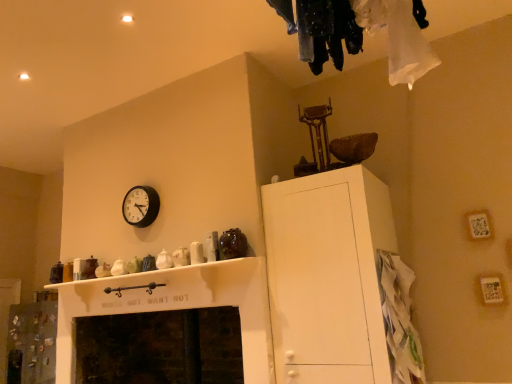
Image resolution: width=512 pixels, height=384 pixels. I want to click on white matte cabinet at upper right, so click(x=327, y=276).

Measure the distance between point (312, 371) and camera.

Point (312, 371) and camera are 2.67 meters apart from each other.

The height and width of the screenshot is (384, 512). What do you see at coordinates (160, 348) in the screenshot? I see `dark stone fireplace at lower center` at bounding box center [160, 348].

Measure the distance between point (234, 346) and camera.

Point (234, 346) and camera are 3.97 meters apart.

Image resolution: width=512 pixels, height=384 pixels. Find the location of `white paper bag at lower right`. white paper bag at lower right is located at coordinates (399, 319).

From the image's perspective, which one is positioned lower, dark stone fireplace at lower center or white paper bag at lower right?

dark stone fireplace at lower center is shown below in the image.

Image resolution: width=512 pixels, height=384 pixels. In order to click on fireplace behind the white paper bag at lower right in this screenshot , I will do `click(160, 348)`.

Relative to white paper bag at lower right, is dark stone fireplace at lower center in front or behind?

dark stone fireplace at lower center is behind white paper bag at lower right.

Considering the relative sizes of dark stone fireplace at lower center and white paper bag at lower right in the image provided, is dark stone fireplace at lower center taller than white paper bag at lower right?

Incorrect, the height of dark stone fireplace at lower center is not larger of that of white paper bag at lower right.

Is black plastic clock at upper left looking in the opposite direction of white matte cabinet at upper right?

No, black plastic clock at upper left is not facing away from white matte cabinet at upper right.

Considering the relative sizes of black plastic clock at upper left and white matte cabinet at upper right in the image provided, is black plastic clock at upper left wider than white matte cabinet at upper right?

No, black plastic clock at upper left is not wider than white matte cabinet at upper right.

Considering the sizes of objects black plastic clock at upper left and white matte cabinet at upper right in the image provided, who is taller, black plastic clock at upper left or white matte cabinet at upper right?

With more height is white matte cabinet at upper right.

From a real-world perspective, which is physically below, black plastic clock at upper left or white matte cabinet at upper right?

white matte cabinet at upper right is physically lower.

Are white paper bag at lower right and dark stone fireplace at lower center beside each other?

white paper bag at lower right and dark stone fireplace at lower center are clearly separated.

From the image's perspective, is white paper bag at lower right beneath dark stone fireplace at lower center?

No, from the image's perspective, white paper bag at lower right is not beneath dark stone fireplace at lower center.

In the scene shown: Considering the relative sizes of white paper bag at lower right and dark stone fireplace at lower center in the image provided, is white paper bag at lower right thinner than dark stone fireplace at lower center?

Yes.

What's the angular difference between white paper bag at lower right and dark stone fireplace at lower center's facing directions?

The angular difference between white paper bag at lower right and dark stone fireplace at lower center is 90.6 degrees.

Does white paper bag at lower right appear on the left side of black plastic clock at upper left?

No.

Is white paper bag at lower right positioned with its back to black plastic clock at upper left?

Yes, white paper bag at lower right's orientation is away from black plastic clock at upper left.

Is white paper bag at lower right wider or thinner than black plastic clock at upper left?

In the image, white paper bag at lower right appears to be wider than black plastic clock at upper left.

How different are the orientations of white paper bag at lower right and black plastic clock at upper left in degrees?

The facing directions of white paper bag at lower right and black plastic clock at upper left are 91.7 degrees apart.

Consider the image. How many degrees apart are the facing directions of white matte cabinet at upper right and white paper bag at lower right?

white matte cabinet at upper right and white paper bag at lower right are facing 90 degrees away from each other.

Considering the positions of objects white matte cabinet at upper right and white paper bag at lower right in the image provided, who is more to the right, white matte cabinet at upper right or white paper bag at lower right?

From the viewer's perspective, white paper bag at lower right appears more on the right side.

Which of these two, white matte cabinet at upper right or white paper bag at lower right, is bigger?

white matte cabinet at upper right.

Find the location of a particular element. Image resolution: width=512 pixels, height=384 pixels. cabinetry on the left of white paper bag at lower right is located at coordinates (327, 276).

Considering the relative positions of white matte cabinet at upper right and dark stone fireplace at lower center in the image provided, is white matte cabinet at upper right to the left of dark stone fireplace at lower center from the viewer's perspective?

Incorrect, white matte cabinet at upper right is not on the left side of dark stone fireplace at lower center.

Considering the relative sizes of white matte cabinet at upper right and dark stone fireplace at lower center in the image provided, is white matte cabinet at upper right shorter than dark stone fireplace at lower center?

In fact, white matte cabinet at upper right may be taller than dark stone fireplace at lower center.

Does white matte cabinet at upper right lie in front of dark stone fireplace at lower center?

Yes, white matte cabinet at upper right is closer to the viewer.

Is white matte cabinet at upper right bigger or smaller than dark stone fireplace at lower center?

Clearly, white matte cabinet at upper right is larger in size than dark stone fireplace at lower center.

From the image's perspective, is white paper bag at lower right under white matte cabinet at upper right?

Yes.

Considering the sizes of white paper bag at lower right and white matte cabinet at upper right in the image, is white paper bag at lower right taller or shorter than white matte cabinet at upper right?

In the image, white paper bag at lower right appears to be shorter than white matte cabinet at upper right.

Considering the relative positions of white paper bag at lower right and white matte cabinet at upper right in the image provided, is white paper bag at lower right to the left of white matte cabinet at upper right from the viewer's perspective?

No, white paper bag at lower right is not to the left of white matte cabinet at upper right.

Identify the location of fireplace on the left side of white paper bag at lower right. (160, 348).

Find the location of a particular element. Image resolution: width=512 pixels, height=384 pixels. cabinetry below the black plastic clock at upper left (from the image's perspective) is located at coordinates (327, 276).

Based on their spatial positions, is dark stone fireplace at lower center or white matte cabinet at upper right closer to white paper bag at lower right?

Based on the image, white matte cabinet at upper right appears to be nearer to white paper bag at lower right.

Estimate the real-world distances between objects in this image. Which object is closer to white paper bag at lower right, white matte cabinet at upper right or dark stone fireplace at lower center?

white matte cabinet at upper right lies closer to white paper bag at lower right than the other object.

Considering their positions, is white paper bag at lower right positioned further to black plastic clock at upper left than dark stone fireplace at lower center?

Among the two, white paper bag at lower right is located further to black plastic clock at upper left.

From the image, which object appears to be farther from black plastic clock at upper left, dark stone fireplace at lower center or white paper bag at lower right?

white paper bag at lower right is further to black plastic clock at upper left.

From the image, which object appears to be farther from dark stone fireplace at lower center, white paper bag at lower right or white matte cabinet at upper right?

white paper bag at lower right is positioned further to the anchor dark stone fireplace at lower center.

Estimate the real-world distances between objects in this image. Which object is closer to white paper bag at lower right, black plastic clock at upper left or white matte cabinet at upper right?

Among the two, white matte cabinet at upper right is located nearer to white paper bag at lower right.

Looking at the image, which one is located closer to black plastic clock at upper left, white paper bag at lower right or white matte cabinet at upper right?

white matte cabinet at upper right.

Which object lies nearer to the anchor point black plastic clock at upper left, dark stone fireplace at lower center or white matte cabinet at upper right?

dark stone fireplace at lower center is positioned closer to the anchor black plastic clock at upper left.

The height and width of the screenshot is (384, 512). I want to click on fireplace between black plastic clock at upper left and white matte cabinet at upper right from left to right, so click(x=160, y=348).

Where is `cabinetry situated between black plastic clock at upper left and white paper bag at lower right from left to right`? cabinetry situated between black plastic clock at upper left and white paper bag at lower right from left to right is located at coordinates pyautogui.click(x=327, y=276).

Find the location of a particular element. fireplace located between black plastic clock at upper left and white paper bag at lower right in the left-right direction is located at coordinates (160, 348).

This screenshot has width=512, height=384. Find the location of `cabinetry situated between dark stone fireplace at lower center and white paper bag at lower right from left to right`. cabinetry situated between dark stone fireplace at lower center and white paper bag at lower right from left to right is located at coordinates (327, 276).